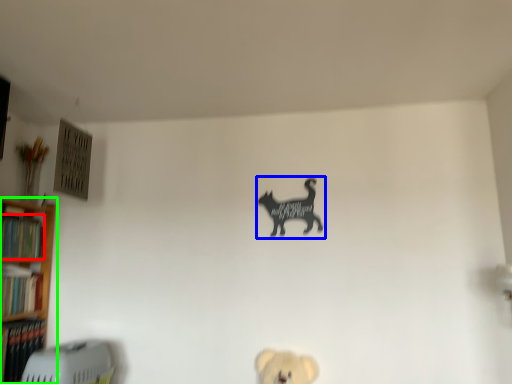
Question: Which object is positioned farthest from book (highlighted by a red box)? Select from animal (highlighted by a blue box) and shelf (highlighted by a green box).

Choices:
 (A) animal
 (B) shelf

Answer: (A)